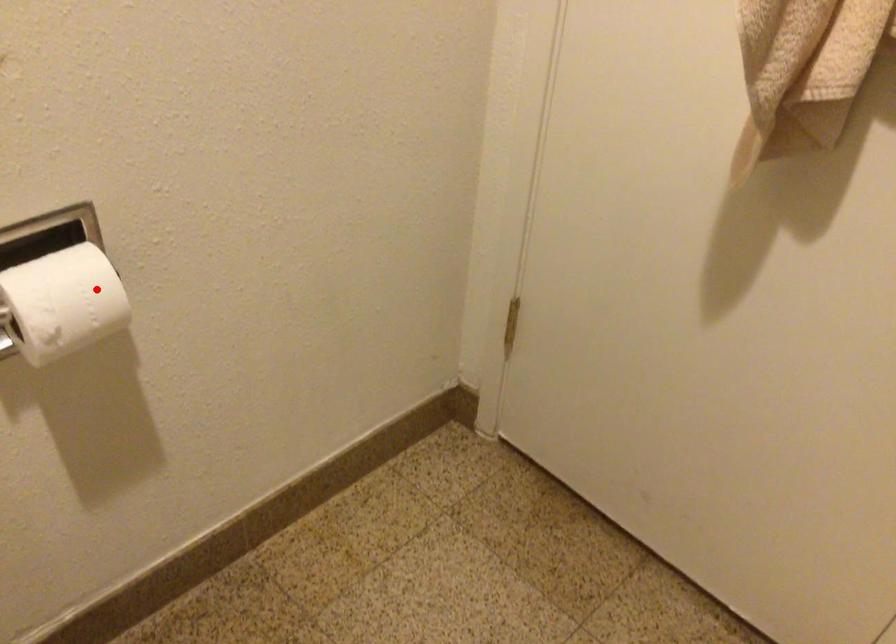
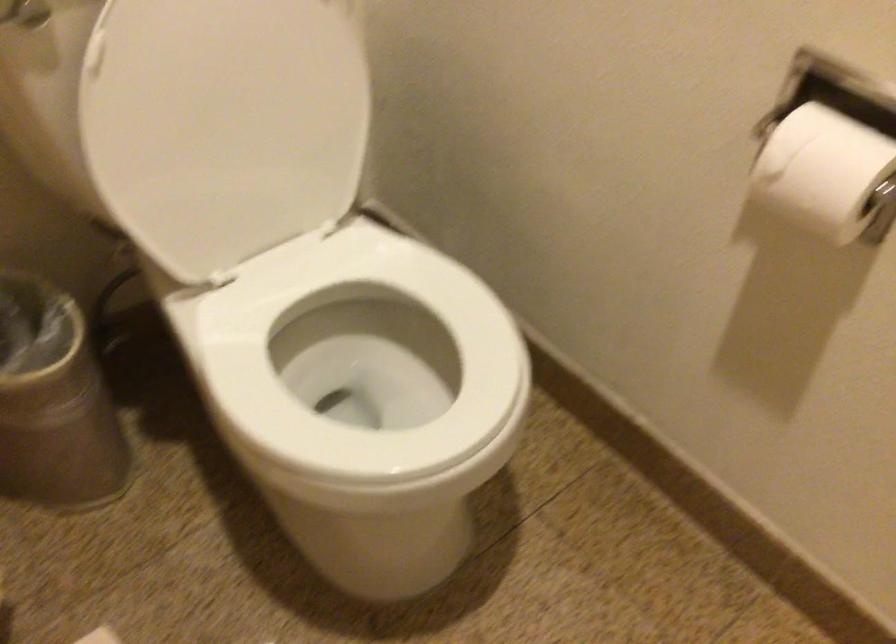
Question: A red point is marked in image1. In image2, is the corresponding 3D point closer to the camera or farther? Reply with the corresponding letter.

Choices:
 (A) The corresponding 3D point is closer.
 (B) The corresponding 3D point is farther.

Answer: (A)